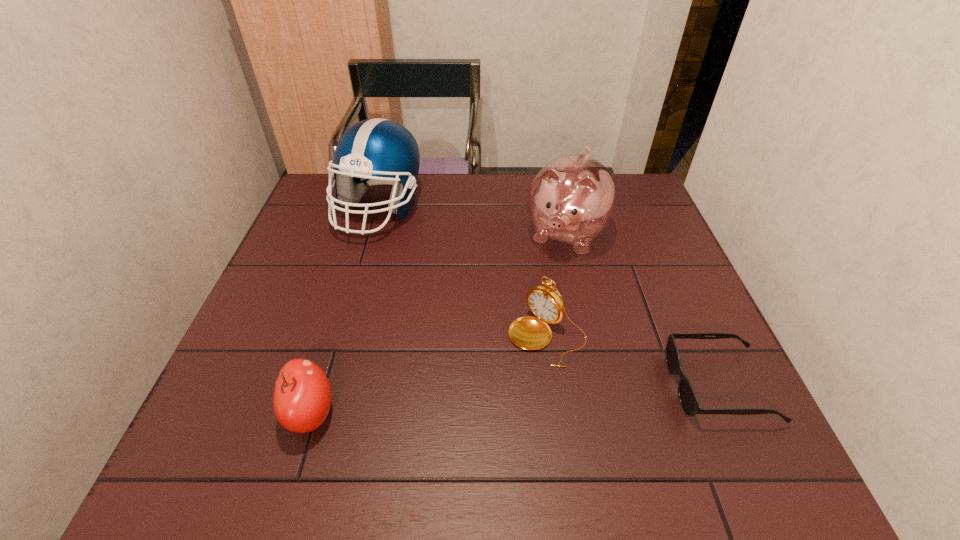
At what (x,y) coordinates should I click in order to perform the action: click on vacant space situated 0.400m at the front lenses of the shortest object. Please return your answer as a coordinate pair (x, y). Looking at the image, I should click on (474, 386).

Locate an element on the screen. The height and width of the screenshot is (540, 960). vacant space positioned at the front lenses of the shortest object is located at coordinates (479, 386).

The height and width of the screenshot is (540, 960). What are the coordinates of `vacant space located on the front facing side of the piggy bank` in the screenshot? It's located at (544, 282).

Identify the location of free space located 0.240m on the front facing side of the piggy bank. (522, 327).

Where is `free region located 0.250m on the front facing side of the piggy bank`? The height and width of the screenshot is (540, 960). free region located 0.250m on the front facing side of the piggy bank is located at coordinates (521, 330).

This screenshot has width=960, height=540. I want to click on free space located on the face of the pocket watch, so click(x=488, y=399).

Where is `vacant position located 0.110m on the face of the pocket watch`? This screenshot has width=960, height=540. vacant position located 0.110m on the face of the pocket watch is located at coordinates (491, 395).

I want to click on free space located on the face of the pocket watch, so click(x=484, y=402).

Where is `vacant area situated 0.110m at the front of the football helmet with the faceguard`? The image size is (960, 540). vacant area situated 0.110m at the front of the football helmet with the faceguard is located at coordinates (397, 268).

Where is `free location located at the front of the football helmet with the faceguard`? free location located at the front of the football helmet with the faceguard is located at coordinates (396, 264).